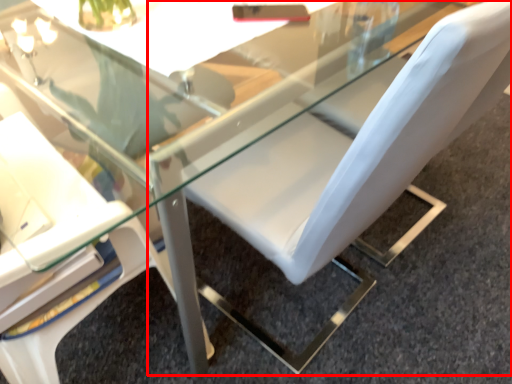
Question: Considering the relative positions of chair (annotated by the red box) and chair in the image provided, where is chair (annotated by the red box) located with respect to the staircase?

Choices:
 (A) right
 (B) left

Answer: (A)